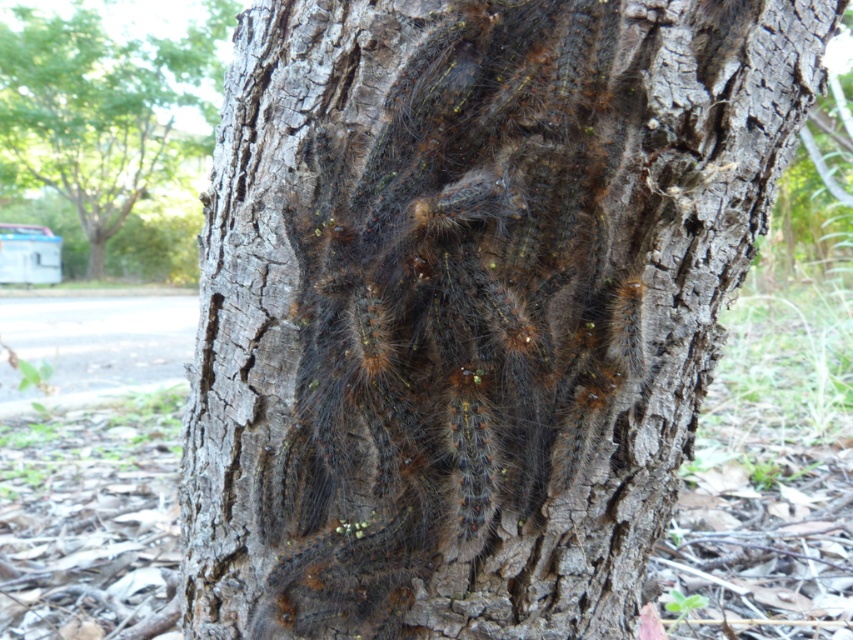
Question: Does fuzzy brown caterpillars at center appear under brown fuzzy caterpillars at upper center?

Choices:
 (A) no
 (B) yes

Answer: (B)

Question: Which point is farther to the camera?

Choices:
 (A) (506, 360)
 (B) (163, 74)

Answer: (B)

Question: Which of the following is the closest to the observer?

Choices:
 (A) fuzzy brown caterpillars at center
 (B) brown fuzzy caterpillars at upper center

Answer: (A)

Question: Is fuzzy brown caterpillars at center positioned before brown fuzzy caterpillars at upper center?

Choices:
 (A) no
 (B) yes

Answer: (B)

Question: Which point is closer to the camera taking this photo?

Choices:
 (A) (91, 125)
 (B) (576, 154)

Answer: (B)

Question: Does fuzzy brown caterpillars at center appear on the right side of brown fuzzy caterpillars at upper center?

Choices:
 (A) yes
 (B) no

Answer: (A)